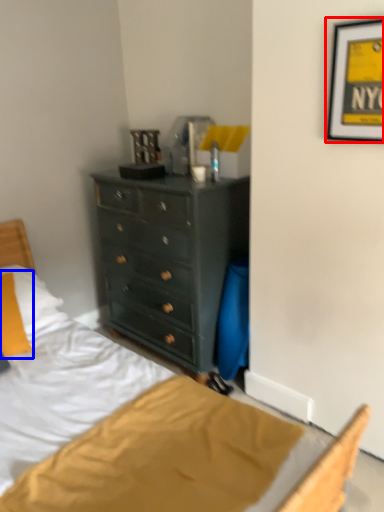
Question: Among these objects, which one is nearest to the camera, picture frame (highlighted by a red box) or pillow (highlighted by a blue box)?

Choices:
 (A) picture frame
 (B) pillow

Answer: (A)